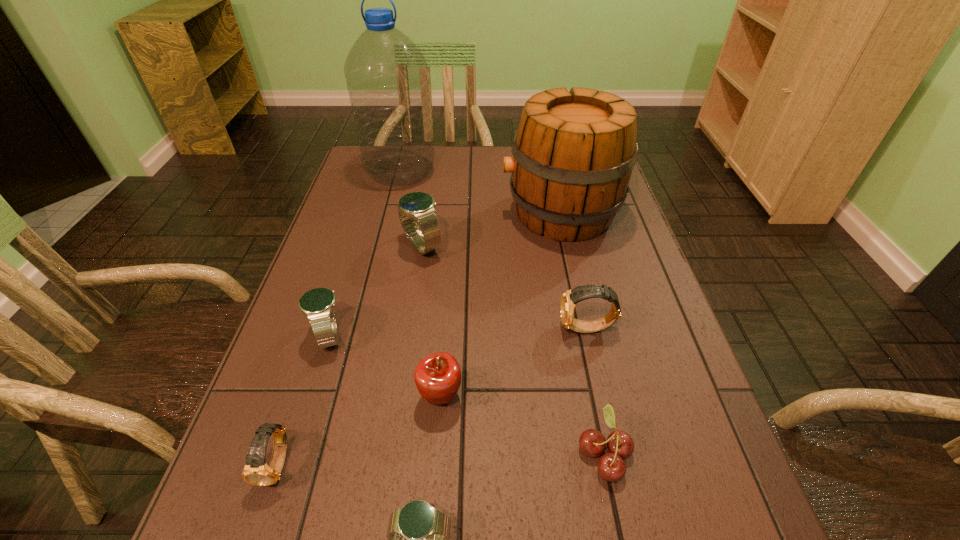
In order to click on free space between the farthest blue watch and the leftmost blue watch in this screenshot , I will do `click(376, 291)`.

Locate an element on the screen. unoccupied position between the biggest blue watch and the leftmost blue watch is located at coordinates (376, 291).

The width and height of the screenshot is (960, 540). Identify the location of empty space between the farther gold watch and the tallest object. (493, 250).

Locate an element on the screen. The width and height of the screenshot is (960, 540). free space between the second tallest object and the sixth farthest object is located at coordinates (500, 305).

The image size is (960, 540). Find the location of `free point between the smaller gold watch and the apple`. free point between the smaller gold watch and the apple is located at coordinates (360, 430).

Find the location of `unoccupied position between the fourth nearest object and the blue water jug`. unoccupied position between the fourth nearest object and the blue water jug is located at coordinates (420, 284).

You are a GUI agent. You are given a task and a screenshot of the screen. Output one action in this format:
    pyautogui.click(x=<x>, y=<y>)
    Task: Click on the object that stands as the second closest to the fourth farthest watch
    
    Given the screenshot: What is the action you would take?
    pyautogui.click(x=418, y=535)

Locate an element on the screen. This screenshot has width=960, height=540. object that stands as the seventh closest to the biggest blue watch is located at coordinates (611, 466).

Select which watch appears as the closest to the blue water jug. Please provide its 2D coordinates. Your answer should be formatted as a tuple, i.e. [(x, y)], where the tuple contains the x and y coordinates of a point satisfying the conditions above.

[(417, 206)]

Identify which watch is the fourth closest to the red cherry. Please provide its 2D coordinates. Your answer should be formatted as a tuple, i.e. [(x, y)], where the tuple contains the x and y coordinates of a point satisfying the conditions above.

[(257, 472)]